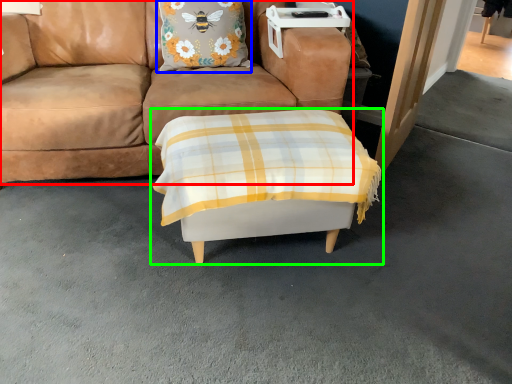
Question: Considering the real-world distances, which object is farthest from studio couch (highlighted by a red box)? pillow (highlighted by a blue box) or table (highlighted by a green box)?

Choices:
 (A) pillow
 (B) table

Answer: (B)